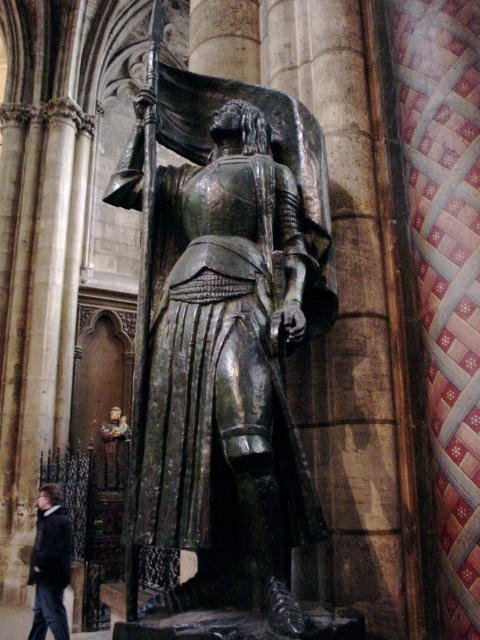
Does bronze statue at center appear on the right side of dark gray wool coat at lower left?

Yes, bronze statue at center is to the right of dark gray wool coat at lower left.

Does point (193, 196) come behind point (67, 627)?

No, it is not.

Locate an element on the screen. The height and width of the screenshot is (640, 480). bronze statue at center is located at coordinates (230, 339).